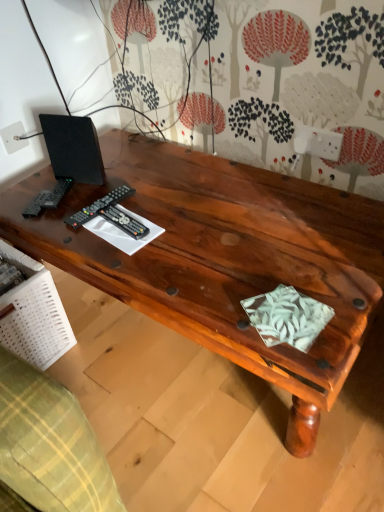
This screenshot has height=512, width=384. Find the location of `free space in front of black matte speaker at upper left`. free space in front of black matte speaker at upper left is located at coordinates (62, 218).